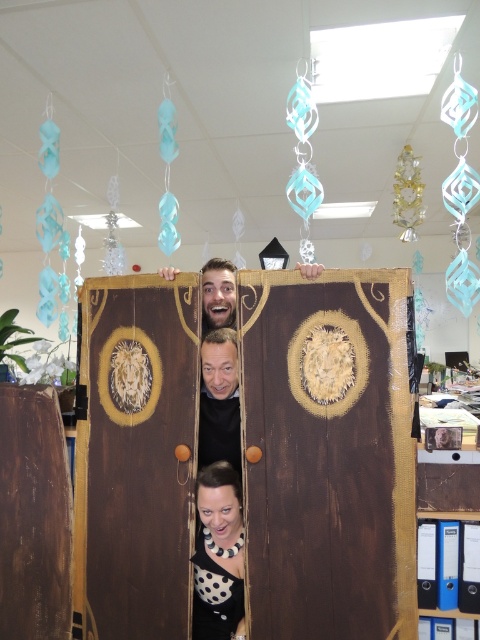
Which is below, polka dot blouse at lower center or wooden door at center?

Positioned lower is polka dot blouse at lower center.

Where is `polka dot blouse at lower center`? polka dot blouse at lower center is located at coordinates (218, 556).

Locate an element on the screen. This screenshot has height=640, width=480. polka dot blouse at lower center is located at coordinates (218, 556).

Looking at this image, who is more distant from viewer, (197, 593) or (235, 436)?

The point (235, 436) is more distant.

Who is more forward, [235,586] or [219,344]?

Positioned in front is point [235,586].

The height and width of the screenshot is (640, 480). What do you see at coordinates (218, 556) in the screenshot?
I see `polka dot blouse at lower center` at bounding box center [218, 556].

I want to click on polka dot blouse at lower center, so click(x=218, y=556).

Which is more to the left, smooth brown wooden door at center or wooden door at center?

From the viewer's perspective, wooden door at center appears more on the left side.

At what (x,y) coordinates should I click in order to perform the action: click on smooth brown wooden door at center. Please return your answer as a coordinate pair (x, y). Image resolution: width=480 pixels, height=640 pixels. Looking at the image, I should click on (218, 400).

Locate an element on the screen. smooth brown wooden door at center is located at coordinates (218, 400).